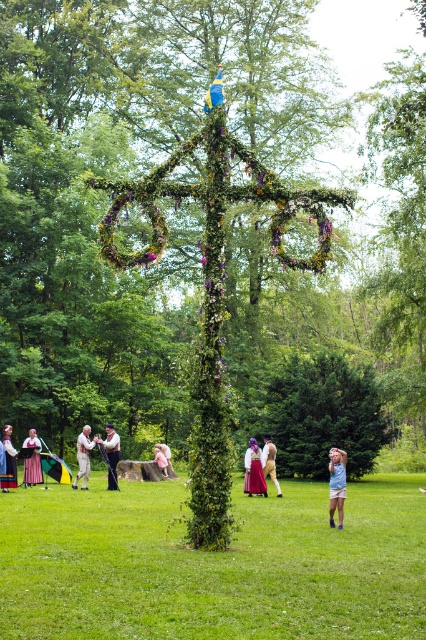
Question: Which object is farther from the camera taking this photo?

Choices:
 (A) blue denim shorts at lower right
 (B) green leafy cross at center
 (C) white cotton shirt at center

Answer: (C)

Question: Does green leafy cross at center have a larger size compared to matte gold dress at center?

Choices:
 (A) no
 (B) yes

Answer: (B)

Question: Which object is farther from the camera taking this photo?

Choices:
 (A) matte purple dress at center
 (B) green velvet dress at center

Answer: (B)

Question: Can you confirm if green leafy cross at center is smaller than matte purple dress at center?

Choices:
 (A) yes
 (B) no

Answer: (B)

Question: Is green grass at center behind matte pink dress at lower left?

Choices:
 (A) no
 (B) yes

Answer: (A)

Question: Estimate the real-world distances between objects in this image. Which object is closer to the white cotton shirt at center?

Choices:
 (A) green leafy cross at center
 (B) blue denim shorts at lower right
 (C) matte gold dress at center

Answer: (C)